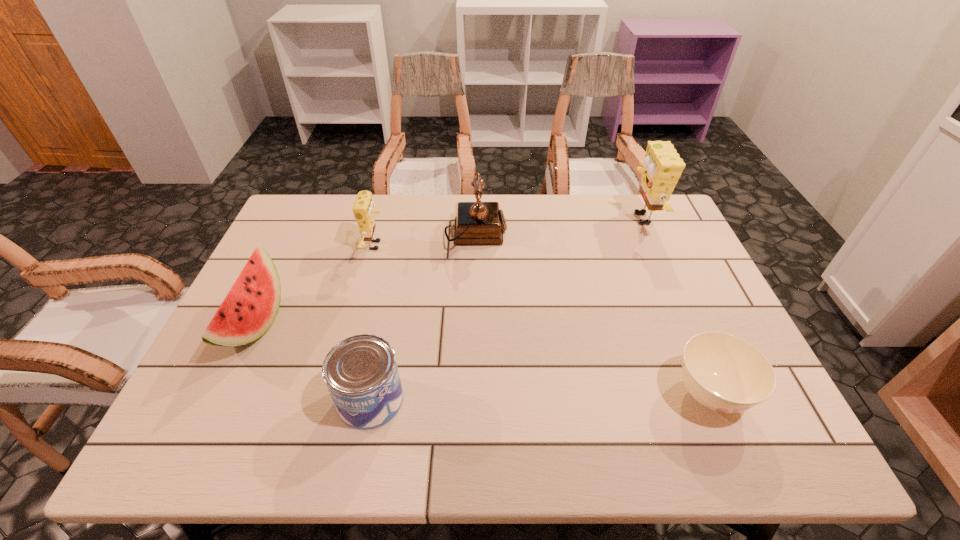
At what (x,y) coordinates should I click in order to perform the action: click on vacant area that lies between the shortest object and the watermelon. Please return your answer as a coordinate pair (x, y). Image resolution: width=960 pixels, height=540 pixels. Looking at the image, I should click on (482, 359).

Where is `free area in between the telephone and the tallest object`? Image resolution: width=960 pixels, height=540 pixels. free area in between the telephone and the tallest object is located at coordinates point(558,226).

I want to click on free space that is in between the taller sponge and the left sponge, so click(x=508, y=232).

You are a GUI agent. You are given a task and a screenshot of the screen. Output one action in this format:
    pyautogui.click(x=<x>, y=<y>)
    Task: Click on the free space between the can and the right sponge
    
    Given the screenshot: What is the action you would take?
    pyautogui.click(x=505, y=309)

Where is `vacant space that's between the watermelon and the telephone`? This screenshot has height=540, width=960. vacant space that's between the watermelon and the telephone is located at coordinates (366, 279).

Identify the location of vacant area that lies between the right sponge and the can. The height and width of the screenshot is (540, 960). (505, 309).

The height and width of the screenshot is (540, 960). Find the location of `empty space between the leftmost object and the left sponge`. empty space between the leftmost object and the left sponge is located at coordinates (315, 285).

Locate an element on the screen. the fifth closest object relative to the taller sponge is located at coordinates (x=249, y=309).

Identify which object is the fifth closest to the fourth object from left to right. Please provide its 2D coordinates. Your answer should be formatted as a tuple, i.e. [(x, y)], where the tuple contains the x and y coordinates of a point satisfying the conditions above.

[(724, 373)]

The width and height of the screenshot is (960, 540). I want to click on vacant space that satisfies the following two spatial constraints: 1. on the dial of the telephone; 2. on the back side of the sugar bowl, so click(474, 394).